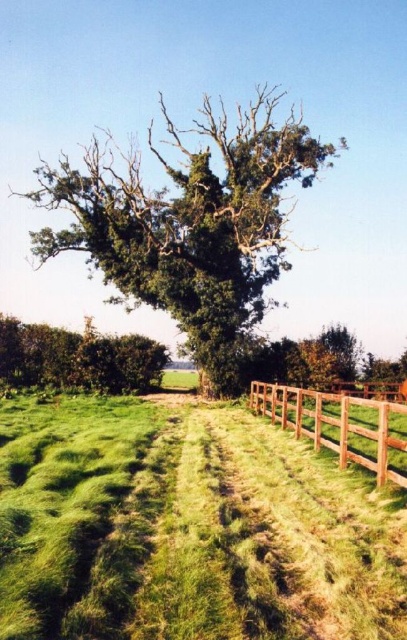
Based on the photo, you are a gardener planning to plant a new flower bed between the green leafy tree at center and the brown wooden fence at right. Given their sizes, which object will require more space to accommodate the flower bed?

The green leafy tree at center has a larger width than the brown wooden fence at right, so it will require more space to accommodate the flower bed.

You are planning to take a photo of the green leafy tree at center and the brown wooden fence at right from a distance. Which object will appear larger in the photo?

The green leafy tree at center will appear larger in the photo because it is bigger than the brown wooden fence at right.

You are standing at the starting point of the grassy path in the rural landscape. The green leafy tree at center is your destination. According to the coordinates provided, in which direction should you walk to reach the tree?

The green leafy tree at center is located at coordinates point (188, 224). Since you are at the starting point of the grassy path, which is likely at the lower part of the image, you should walk towards the center of the image to reach the tree.